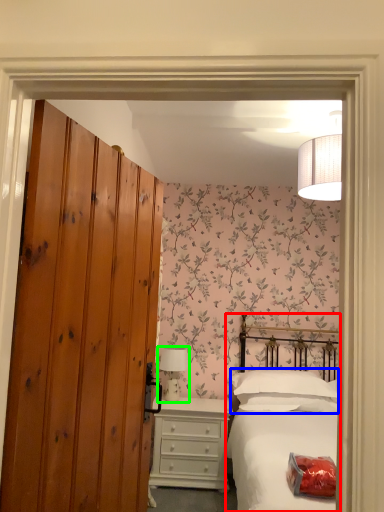
Question: Which object is the farthest from bed (highlighted by a red box)? Choose among these: pillow (highlighted by a blue box) or table lamp (highlighted by a green box).

Choices:
 (A) pillow
 (B) table lamp

Answer: (B)